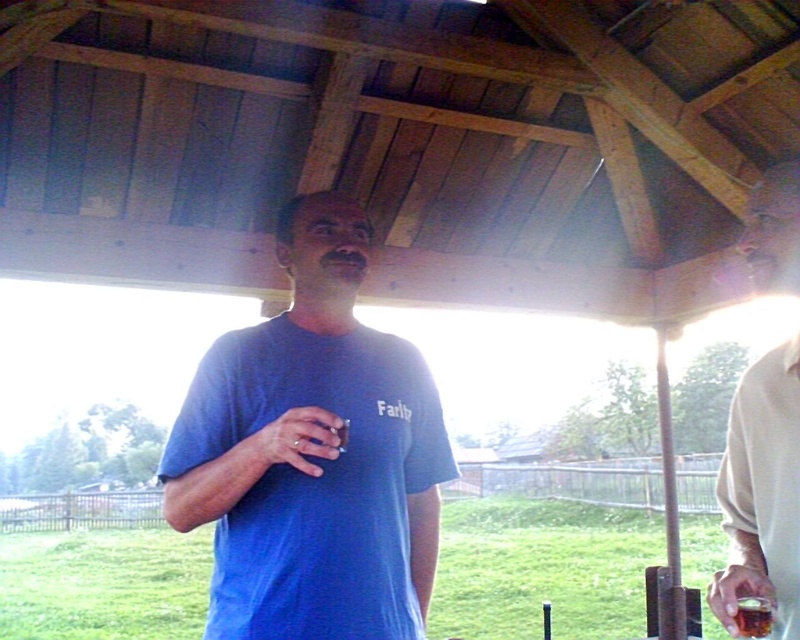
Does blue cotton t-shirt at center appear under translucent glass cup at lower right?

Actually, blue cotton t-shirt at center is above translucent glass cup at lower right.

Which is more to the right, blue cotton t-shirt at center or translucent glass cup at lower right?

translucent glass cup at lower right

This screenshot has height=640, width=800. Identify the location of blue cotton t-shirt at center. coord(312,454).

Consider the image. Can you confirm if blue cotton t-shirt at center is positioned above beige fabric shirt at right?

No.

Can you confirm if blue cotton t-shirt at center is shorter than beige fabric shirt at right?

Indeed, blue cotton t-shirt at center has a lesser height compared to beige fabric shirt at right.

Which is in front, point (397, 554) or point (776, 346)?

Point (397, 554)

Identify the location of blue cotton t-shirt at center. (312, 454).

Who is higher up, beige fabric shirt at right or translucent glass cup at lower right?

beige fabric shirt at right

I want to click on beige fabric shirt at right, so click(762, 493).

Identify the location of beige fabric shirt at right. (762, 493).

Locate an element on the screen. beige fabric shirt at right is located at coordinates (762, 493).